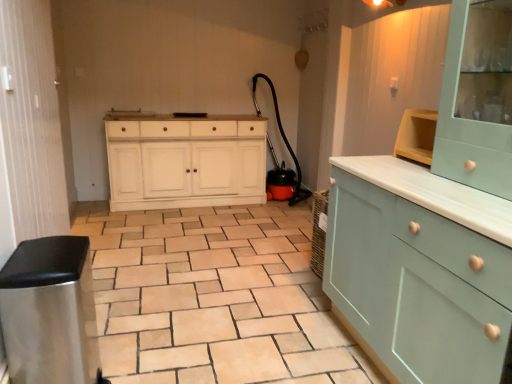
Find the location of a particular element. This screenshot has height=384, width=512. vacant point to the left of light teal wood cabinet at upper right, arranged as the 2th cabinetry when ordered from the bottom is located at coordinates (411, 182).